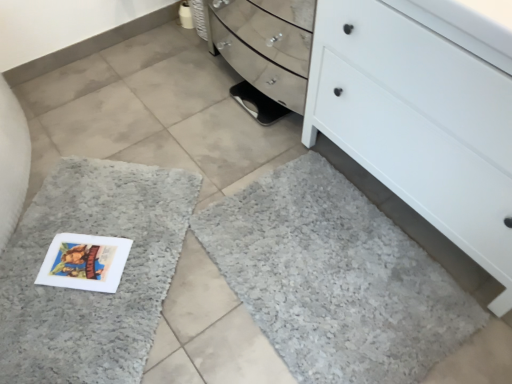
Question: From the image's perspective, is gray shaggy bath mat at lower left, which is the second bath mat from right to left, located above or below gray shaggy bath mat at lower right, the second bath mat when ordered from left to right?

Choices:
 (A) above
 (B) below

Answer: (A)

Question: In terms of size, does gray shaggy bath mat at lower left, which is the second bath mat from right to left, appear bigger or smaller than gray shaggy bath mat at lower right, the 1th bath mat viewed from the right?

Choices:
 (A) small
 (B) big

Answer: (B)

Question: Which of these objects is positioned farthest from the gray shaggy bath mat at lower right, the 1th bath mat viewed from the right?

Choices:
 (A) black rubber shoe at center
 (B) white matte chest of drawers at lower right
 (C) gray shaggy bath mat at lower left, which is the second bath mat from right to left

Answer: (A)

Question: Considering the real-world distances, which object is farthest from the gray shaggy bath mat at lower right, the 1th bath mat viewed from the right?

Choices:
 (A) black rubber shoe at center
 (B) gray shaggy bath mat at lower left, which is the second bath mat from right to left
 (C) white matte chest of drawers at lower right

Answer: (A)